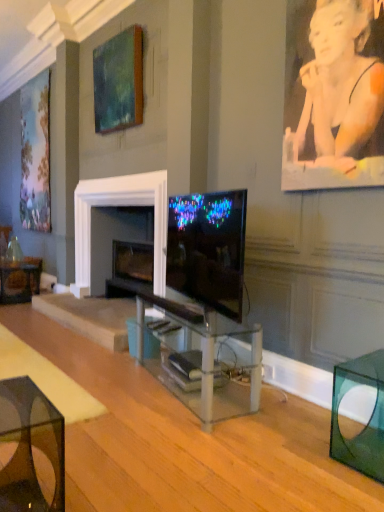
Question: Does black plastic remote control at center, the first remote control from the back, have a greater width compared to teal matte painting at upper center, arranged as the 2th picture frame when viewed from the left?

Choices:
 (A) yes
 (B) no

Answer: (A)

Question: Is the position of black plastic remote control at center, the first remote control from the back, more distant than that of teal matte painting at upper center, the 2th picture frame positioned from the back?

Choices:
 (A) yes
 (B) no

Answer: (B)

Question: Considering the relative sizes of black plastic remote control at center, the 2th remote control viewed from the front, and teal matte painting at upper center, the 2th picture frame positioned from the back, in the image provided, is black plastic remote control at center, the 2th remote control viewed from the front, thinner than teal matte painting at upper center, the 2th picture frame positioned from the back,?

Choices:
 (A) no
 (B) yes

Answer: (A)

Question: Is black plastic remote control at center, the first remote control from the back, taller than teal matte painting at upper center, the 2th picture frame positioned from the back?

Choices:
 (A) yes
 (B) no

Answer: (B)

Question: From a real-world perspective, is black plastic remote control at center, the 2th remote control viewed from the front, over teal matte painting at upper center, the 2th picture frame positioned from the back?

Choices:
 (A) no
 (B) yes

Answer: (A)

Question: Visually, is pastel floral fabric at left, the second picture frame in the right-to-left sequence, positioned to the left or to the right of black plastic remote control at center, positioned as the first remote control in front-to-back order?

Choices:
 (A) right
 (B) left

Answer: (B)

Question: From a real-world perspective, is pastel floral fabric at left, the second picture frame in the right-to-left sequence, physically located above or below black plastic remote control at center, which appears as the 2th remote control when viewed from the back?

Choices:
 (A) above
 (B) below

Answer: (A)

Question: In terms of size, does pastel floral fabric at left, the 1th picture frame in the back-to-front sequence, appear bigger or smaller than black plastic remote control at center, positioned as the first remote control in front-to-back order?

Choices:
 (A) small
 (B) big

Answer: (B)

Question: Considering their positions, is pastel floral fabric at left, positioned as the 2th picture frame in front-to-back order, located in front of or behind black plastic remote control at center, positioned as the first remote control in front-to-back order?

Choices:
 (A) front
 (B) behind

Answer: (B)

Question: Is pastel floral fabric at left, placed as the 1th picture frame when sorted from left to right, inside or outside of smooth skin portrait at upper right?

Choices:
 (A) outside
 (B) inside

Answer: (A)

Question: Is pastel floral fabric at left, the second picture frame in the right-to-left sequence, in front of or behind smooth skin portrait at upper right in the image?

Choices:
 (A) front
 (B) behind

Answer: (B)

Question: Considering the positions of pastel floral fabric at left, placed as the 1th picture frame when sorted from left to right, and smooth skin portrait at upper right in the image, is pastel floral fabric at left, placed as the 1th picture frame when sorted from left to right, taller or shorter than smooth skin portrait at upper right?

Choices:
 (A) tall
 (B) short

Answer: (A)

Question: Is pastel floral fabric at left, placed as the 1th picture frame when sorted from left to right, bigger or smaller than smooth skin portrait at upper right?

Choices:
 (A) small
 (B) big

Answer: (B)

Question: Is transparent glass cube at lower right, the 2th table in the front-to-back sequence, taller or shorter than pastel floral fabric at left, the 1th picture frame in the back-to-front sequence?

Choices:
 (A) short
 (B) tall

Answer: (A)

Question: From a real-world perspective, is transparent glass cube at lower right, the third table from the back, above or below pastel floral fabric at left, positioned as the 2th picture frame in front-to-back order?

Choices:
 (A) below
 (B) above

Answer: (A)